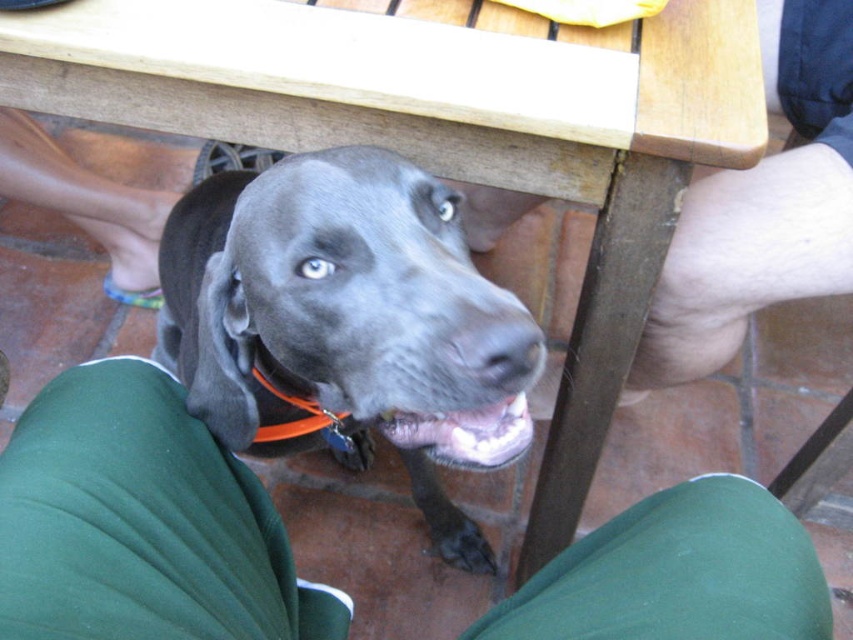
You are a dog owner trying to locate your dog. You see the green fabric pants at lower center and the shiny black dog at center. Which object is closer to you?

The green fabric pants at lower center is in front of the shiny black dog at center, so the green fabric pants at lower center is closer to you.

You are a photographer trying to capture the dog in the image. You notice the shiny black dog at center and the orange plastic neckband at lower center. Which object is positioned more to the left in the image?

The orange plastic neckband at lower center is positioned more to the left than the shiny black dog at center.